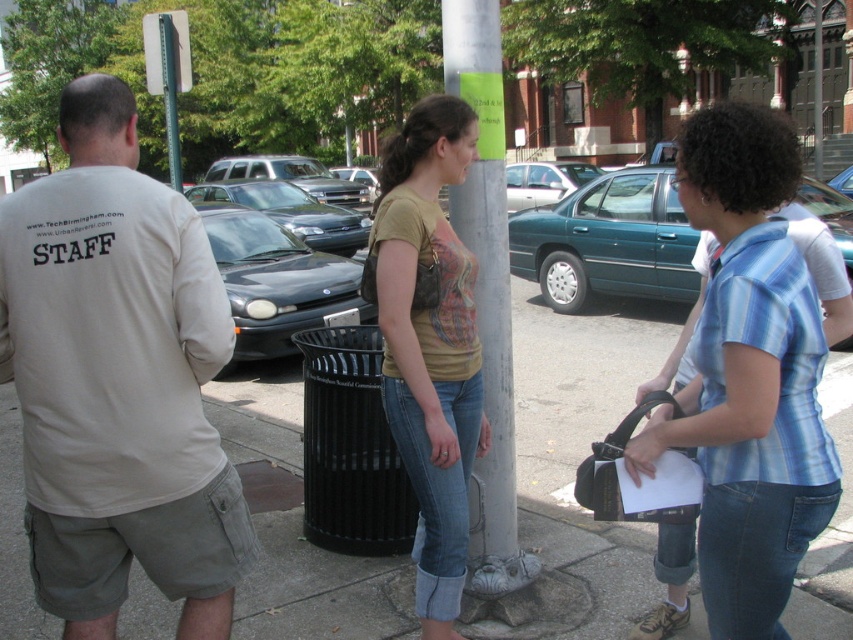
Question: Is matte black car at center thinner than shiny black sedan at center?

Choices:
 (A) no
 (B) yes

Answer: (B)

Question: Is teal matte sedan at center smaller than matte black car at center?

Choices:
 (A) yes
 (B) no

Answer: (A)

Question: Which is farther from the beige cotton shirt at center?

Choices:
 (A) gray metallic pole at center
 (B) shiny black sedan at center
 (C) matte black car at center
 (D) green metallic pole at upper center

Answer: (B)

Question: Estimate the real-world distances between objects in this image. Which object is closer to the matte black car at center?

Choices:
 (A) shiny black sedan at center
 (B) matte yellow t-shirt at center
 (C) smooth concrete sidewalk at center
 (D) teal matte sedan at center

Answer: (D)

Question: Which object is positioned farthest from the gray metallic pole at center?

Choices:
 (A) matte black car at center
 (B) green metallic pole at upper center
 (C) smooth concrete sidewalk at center
 (D) silver metallic suv at center

Answer: (D)

Question: Is teal matte sedan at center thinner than silver metallic suv at center?

Choices:
 (A) no
 (B) yes

Answer: (B)